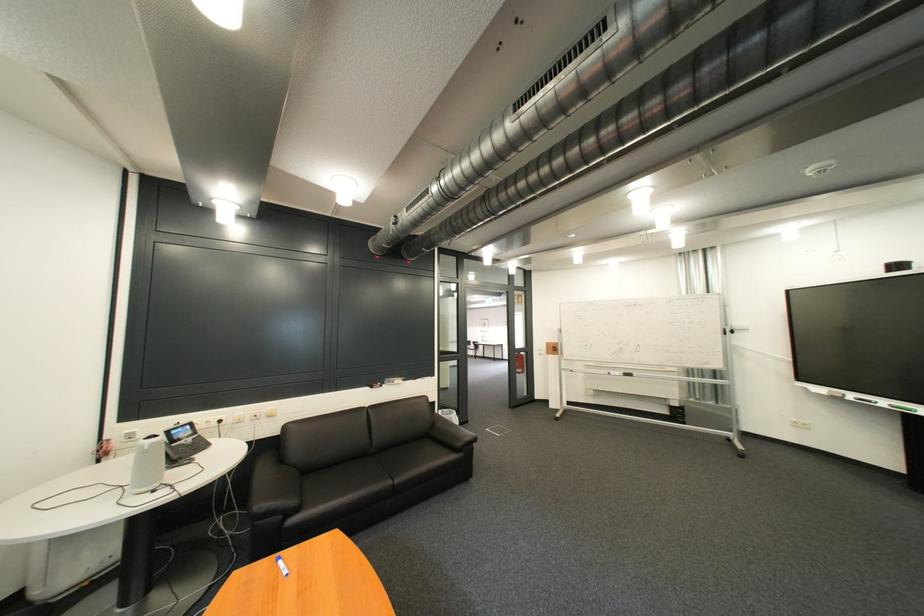
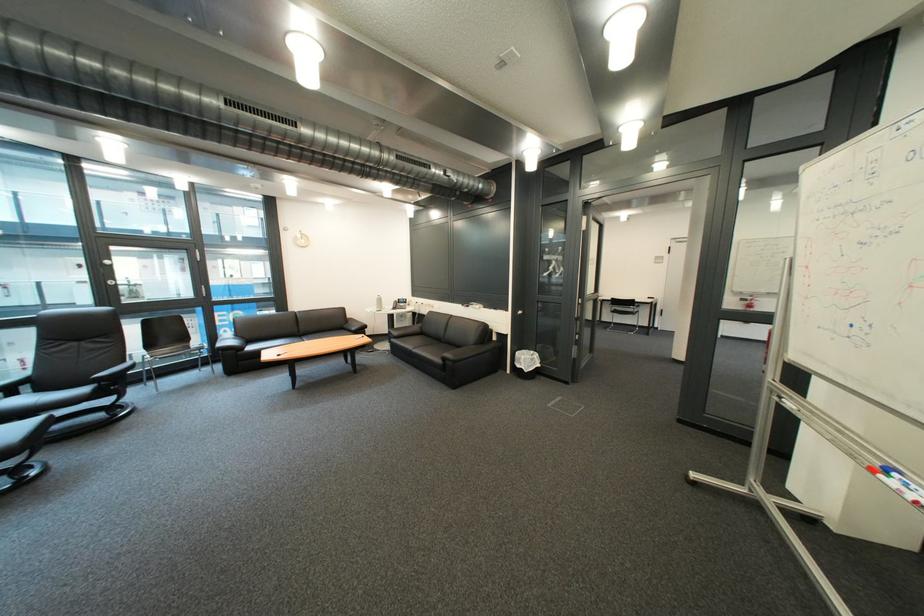
Locate, in the second image, the point that corresponds to (x=468, y=421) in the first image.

(536, 363)